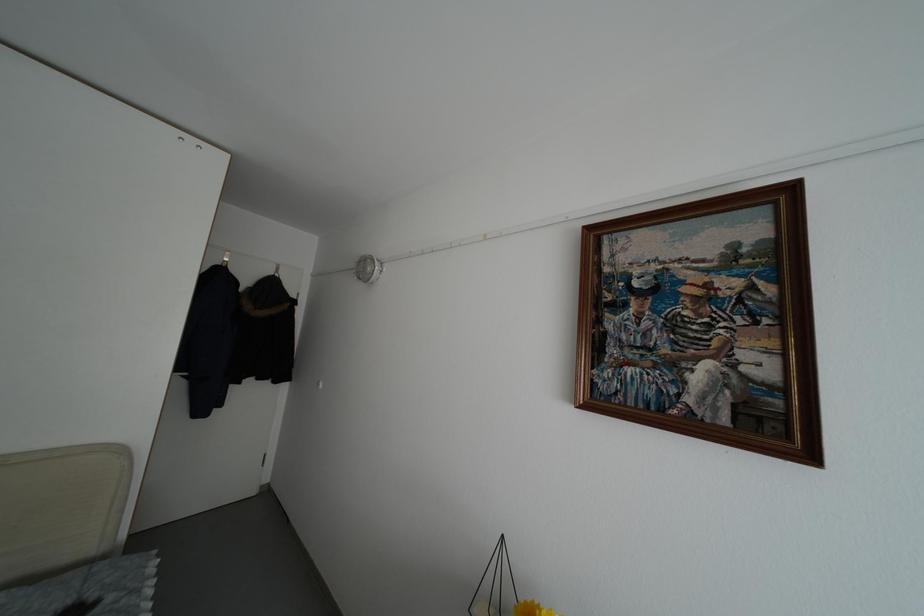
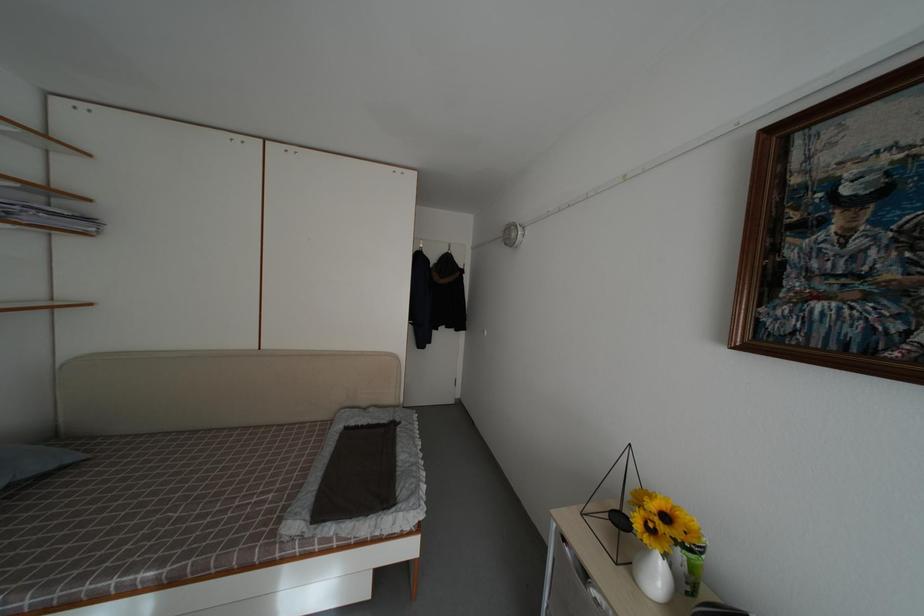
Question: How did the camera likely rotate?

Choices:
 (A) Left
 (B) Right
 (C) Up
 (D) Down

Answer: (A)